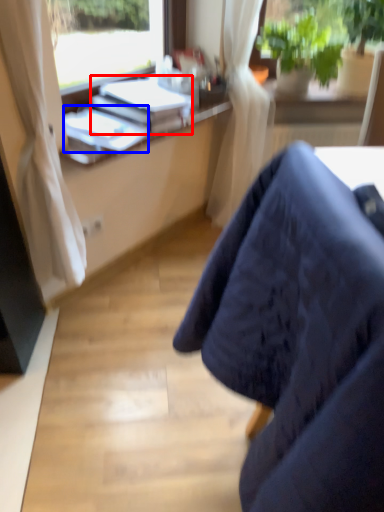
Question: Which of the following is the farthest to the observer, book (highlighted by a red box) or book (highlighted by a blue box)?

Choices:
 (A) book
 (B) book

Answer: (A)